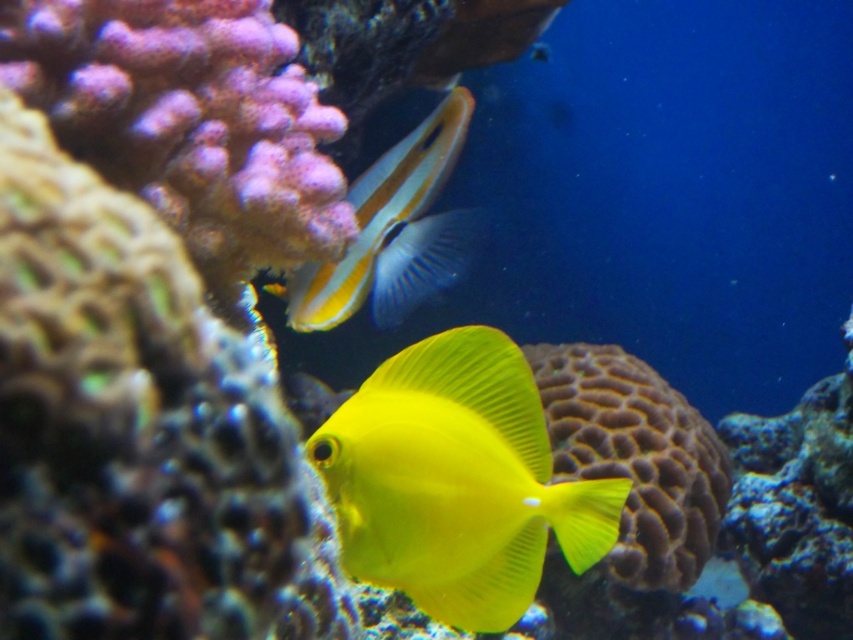
Question: Can you confirm if yellow matte fish at center is thinner than shiny yellow fish at center?

Choices:
 (A) no
 (B) yes

Answer: (B)

Question: Which point is closer to the camera?

Choices:
 (A) (399, 198)
 (B) (403, 408)

Answer: (B)

Question: Is yellow matte fish at center bigger than shiny yellow fish at center?

Choices:
 (A) yes
 (B) no

Answer: (B)

Question: Is yellow matte fish at center below shiny yellow fish at center?

Choices:
 (A) no
 (B) yes

Answer: (B)